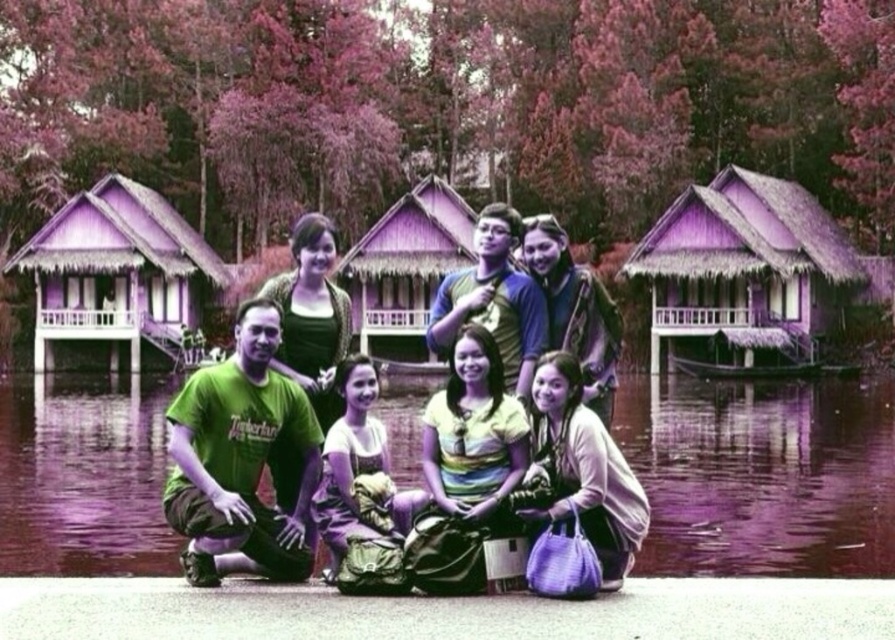
Is green fabric shirt at center to the left of purple wooden hut at left from the viewer's perspective?

Incorrect, green fabric shirt at center is not on the left side of purple wooden hut at left.

Is green fabric shirt at center to the right of purple wooden hut at left from the viewer's perspective?

Yes, green fabric shirt at center is to the right of purple wooden hut at left.

The image size is (895, 640). Describe the element at coordinates (487, 476) in the screenshot. I see `green fabric shirt at center` at that location.

Locate an element on the screen. The height and width of the screenshot is (640, 895). green fabric shirt at center is located at coordinates (487, 476).

Looking at this image, is purple fabric bag at lower right closer to the viewer compared to matte yellow dress at center?

No, purple fabric bag at lower right is further to the viewer.

Is point (572, 365) closer to viewer compared to point (371, 460)?

Yes, point (572, 365) is closer to viewer.

Identify the location of purple fabric bag at lower right. The image size is (895, 640). (584, 468).

Does purple wooden hut at left have a greater width compared to purple wooden hut at center?

Indeed, purple wooden hut at left has a greater width compared to purple wooden hut at center.

Identify the location of purple wooden hut at left. The height and width of the screenshot is (640, 895). click(117, 272).

Where is `purple wooden hut at left`? The height and width of the screenshot is (640, 895). purple wooden hut at left is located at coordinates (117, 272).